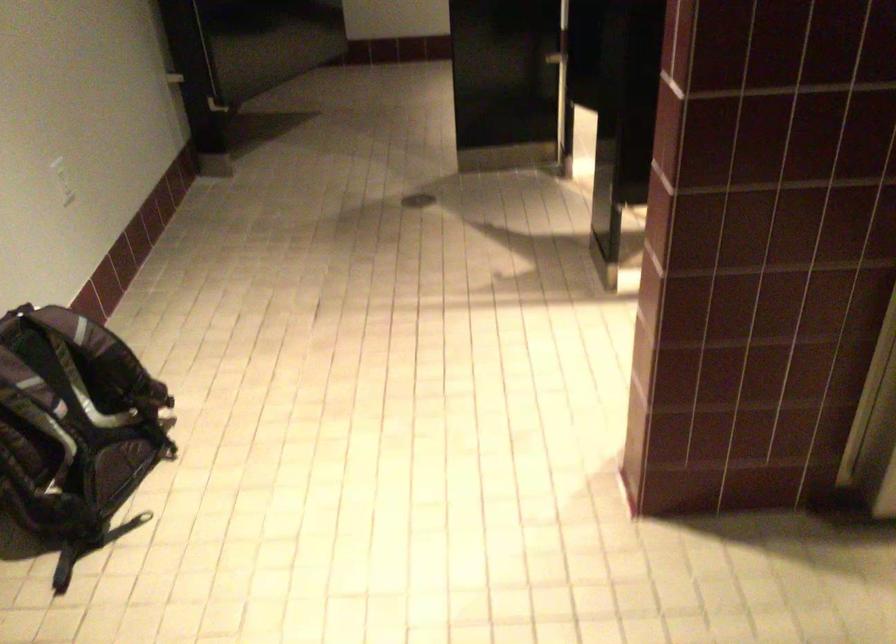
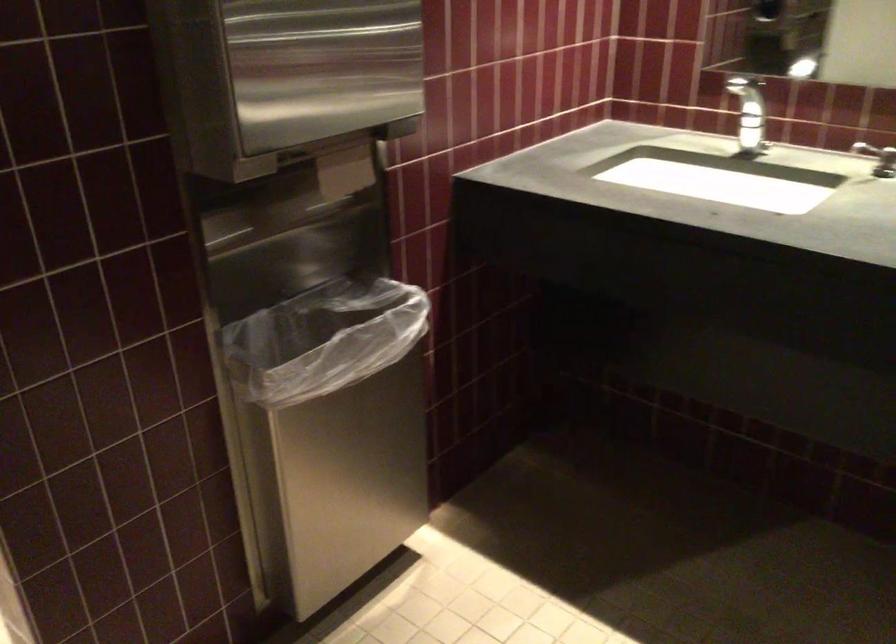
Question: The images are taken continuously from a first-person perspective. In which direction is your viewpoint rotating?

Choices:
 (A) Left
 (B) Right
 (C) Up
 (D) Down

Answer: (B)